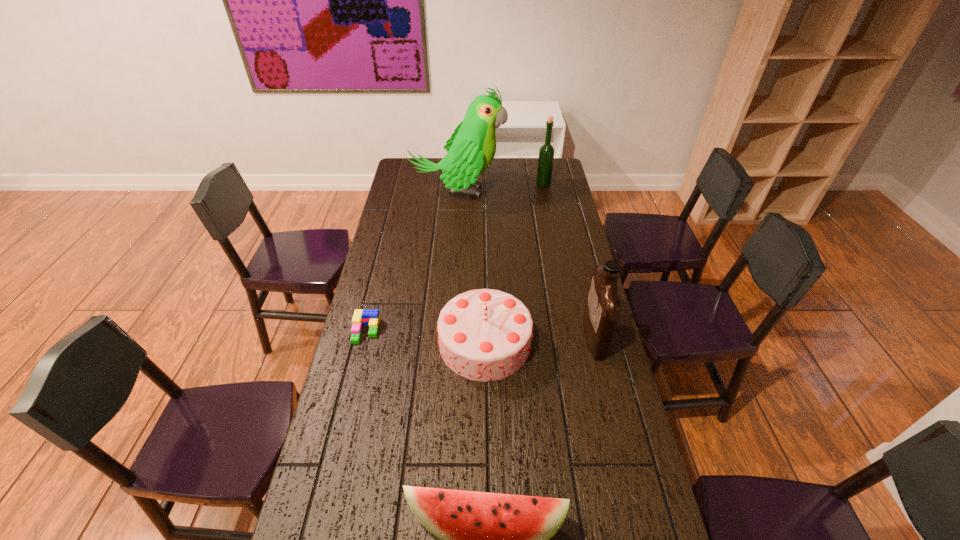
I want to click on unoccupied position between the right liquor and the parakeet, so click(526, 265).

Find the location of a particular element. Image resolution: width=960 pixels, height=540 pixels. free space between the fifth object from left to right and the rightmost object is located at coordinates (568, 260).

I want to click on vacant area that lies between the rightmost object and the farther liquor, so click(x=568, y=260).

Identify the location of free space between the farther liquor and the shortest object. The width and height of the screenshot is (960, 540). (455, 258).

Locate which object ranks in proximity to the leftmost object. Please provide its 2D coordinates. Your answer should be formatted as a tuple, i.e. [(x, y)], where the tuple contains the x and y coordinates of a point satisfying the conditions above.

[(485, 335)]

In order to click on the fourth closest object to the watermelon in this screenshot , I will do `click(472, 147)`.

Identify the location of vacant space that satisfies the following two spatial constraints: 1. on the back side of the farther liquor; 2. on the right side of the Lego. This screenshot has width=960, height=540. (402, 184).